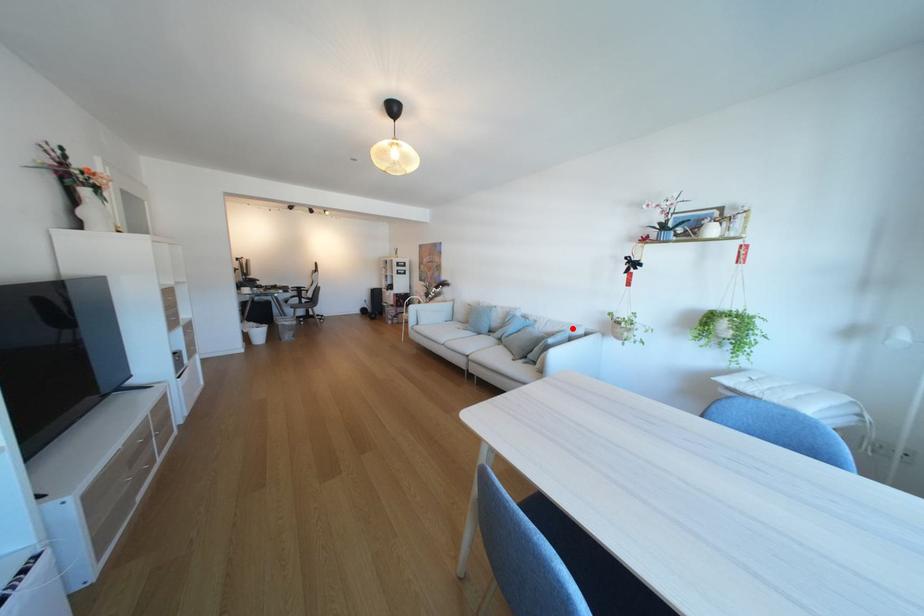
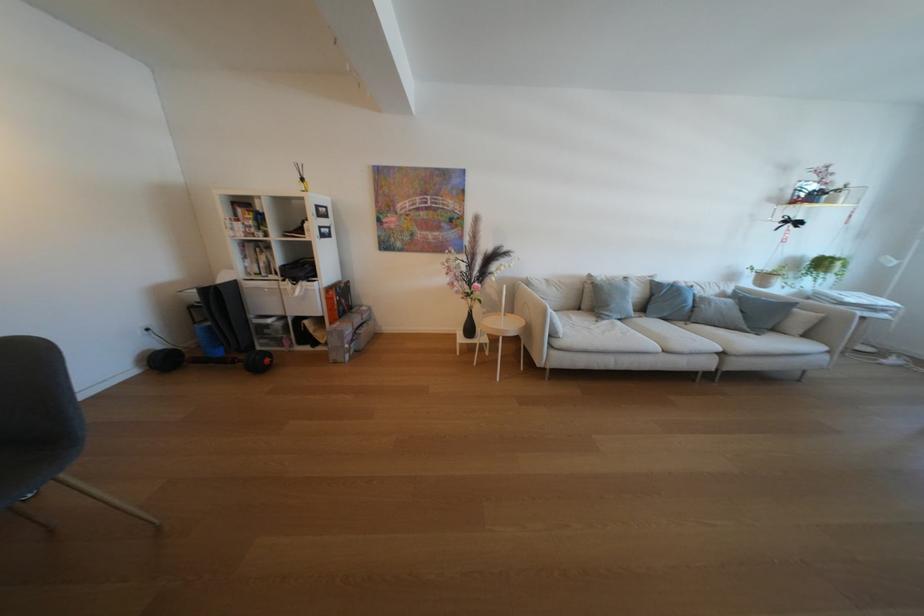
Find the pixel in the second image that matches the highlighted location in the first image.

(730, 289)